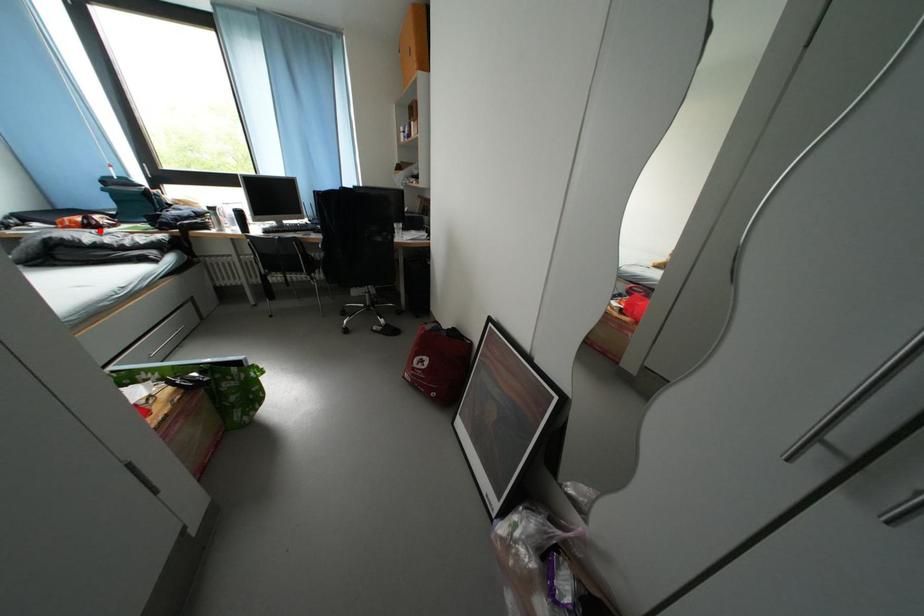
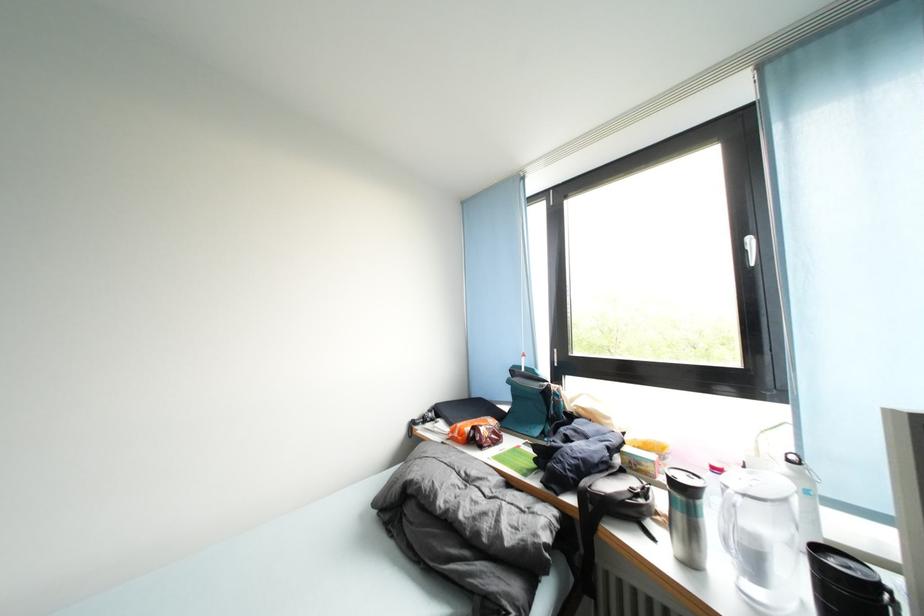
Where in the second image is the point corresponding to the highlighted location from the first image?

(482, 446)